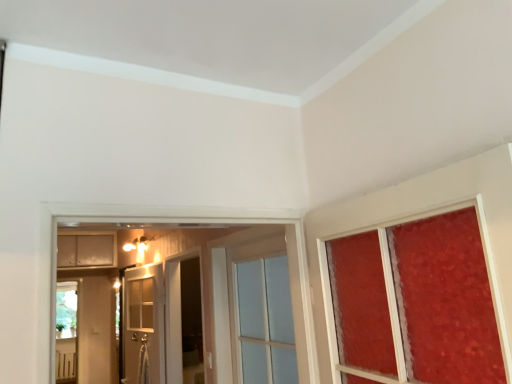
Question: Is white glass door at center, the 2th door when ordered from right to left, not near transparent glass screen door at center?

Choices:
 (A) yes
 (B) no

Answer: (B)

Question: Are white glass door at center, placed as the second door when sorted from front to back, and transparent glass screen door at center beside each other?

Choices:
 (A) no
 (B) yes

Answer: (A)

Question: From the image's perspective, is white glass door at center, placed as the second door when sorted from front to back, on transparent glass screen door at center?

Choices:
 (A) no
 (B) yes

Answer: (A)

Question: Does white glass door at center, which is the first door in back-to-front order, appear on the right side of transparent glass screen door at center?

Choices:
 (A) no
 (B) yes

Answer: (A)

Question: Is white glass door at center, the 1th door in the left-to-right sequence, to the left of transparent glass screen door at center from the viewer's perspective?

Choices:
 (A) no
 (B) yes

Answer: (B)

Question: Is white glass door at center, the 2th door when ordered from right to left, outside transparent glass screen door at center?

Choices:
 (A) yes
 (B) no

Answer: (A)

Question: Is clear glass door at center, marked as the 1th door in a right-to-left arrangement, shorter than transparent glass screen door at center?

Choices:
 (A) no
 (B) yes

Answer: (B)

Question: From the image's perspective, is clear glass door at center, the second door positioned from the left, below transparent glass screen door at center?

Choices:
 (A) yes
 (B) no

Answer: (B)

Question: Is clear glass door at center, which is the 1th door from front to back, far away from transparent glass screen door at center?

Choices:
 (A) no
 (B) yes

Answer: (B)

Question: Is clear glass door at center, the second door positioned from the left, taller than transparent glass screen door at center?

Choices:
 (A) yes
 (B) no

Answer: (B)

Question: Is clear glass door at center, placed as the second door when sorted from back to front, turned away from transparent glass screen door at center?

Choices:
 (A) yes
 (B) no

Answer: (B)

Question: Considering the relative positions of clear glass door at center, which is the 1th door from front to back, and transparent glass screen door at center in the image provided, is clear glass door at center, which is the 1th door from front to back, behind transparent glass screen door at center?

Choices:
 (A) no
 (B) yes

Answer: (A)

Question: Is transparent glass screen door at center thinner than matte white cabinet at upper left?

Choices:
 (A) yes
 (B) no

Answer: (A)